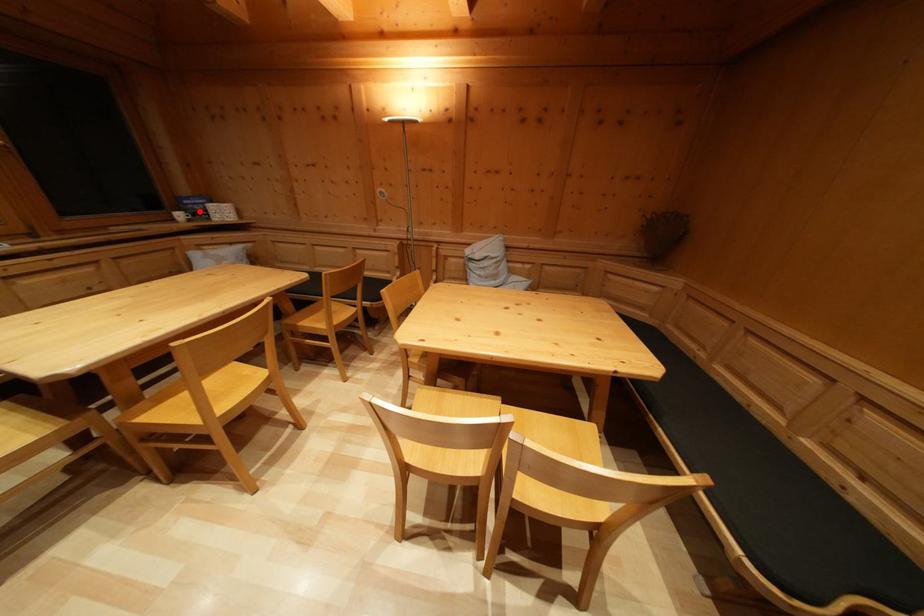
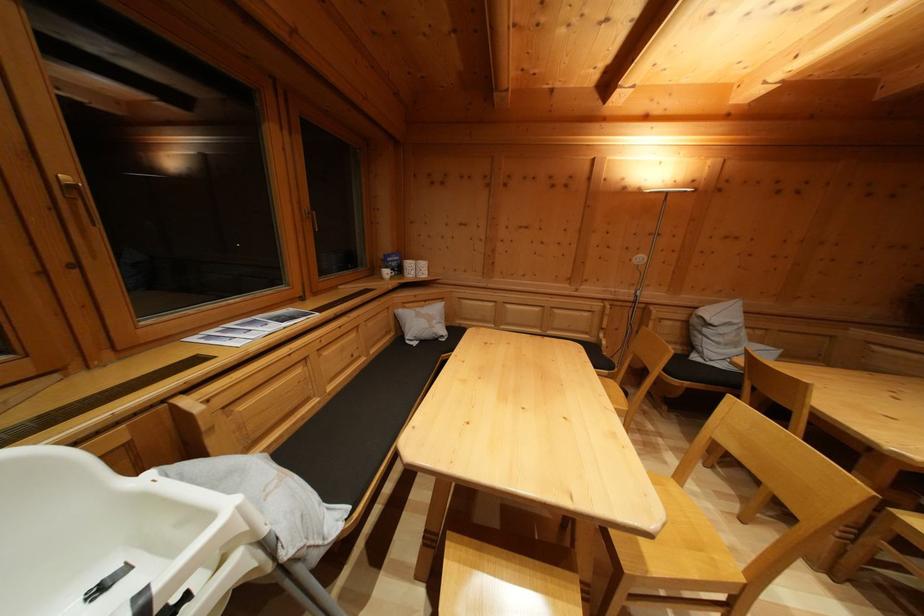
In the second image, find the point that corresponds to the highlighted location in the first image.

(397, 268)